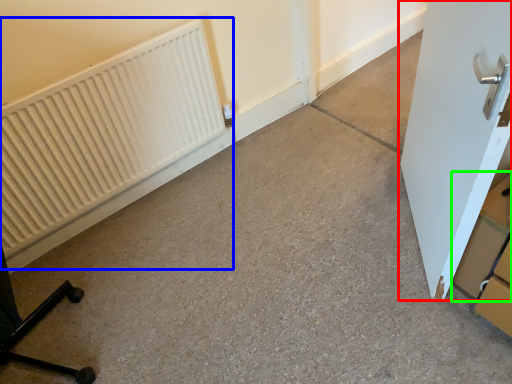
Question: Based on their relative distances, which object is farther from door (highlighted by a red box)? Choose from radiator (highlighted by a blue box) and cardboard box (highlighted by a green box).

Choices:
 (A) radiator
 (B) cardboard box

Answer: (A)